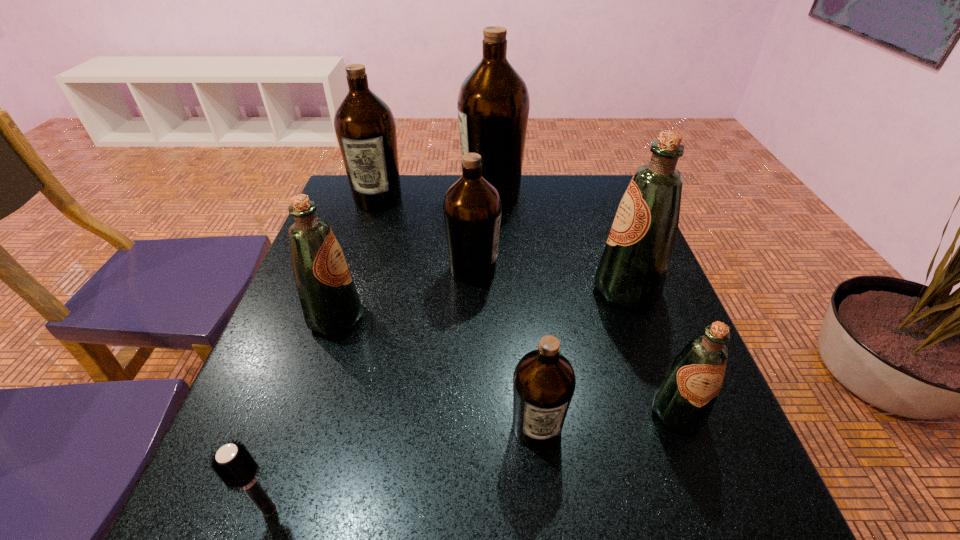
The height and width of the screenshot is (540, 960). In order to click on vacant area situated on the front-facing side of the smallest green olive oil in this screenshot , I will do `click(721, 532)`.

The image size is (960, 540). I want to click on free space located 0.060m on the back of the hairbrush, so click(x=287, y=457).

Locate an element on the screen. object situated at the near edge is located at coordinates (235, 466).

You are a GUI agent. You are given a task and a screenshot of the screen. Output one action in this format:
    pyautogui.click(x=<x>, y=<y>)
    Task: Click on the hairbrush at the left edge
    Image resolution: width=960 pixels, height=540 pixels.
    Given the screenshot: What is the action you would take?
    pyautogui.click(x=235, y=466)

Where is `object present at the far left corner`? Image resolution: width=960 pixels, height=540 pixels. object present at the far left corner is located at coordinates (365, 127).

This screenshot has height=540, width=960. What are the coordinates of `object that is at the near left corner` in the screenshot? It's located at (235, 466).

The width and height of the screenshot is (960, 540). Find the location of `free space at the far edge of the desktop`. free space at the far edge of the desktop is located at coordinates (536, 191).

In the image, there is a desktop. Identify the location of blank space at the near edge. The image size is (960, 540). click(402, 484).

In the image, there is a desktop. Find the location of `vacant space at the far left corner`. vacant space at the far left corner is located at coordinates pos(380,218).

In the image, there is a desktop. Identify the location of blank space at the near left corner. (225, 535).